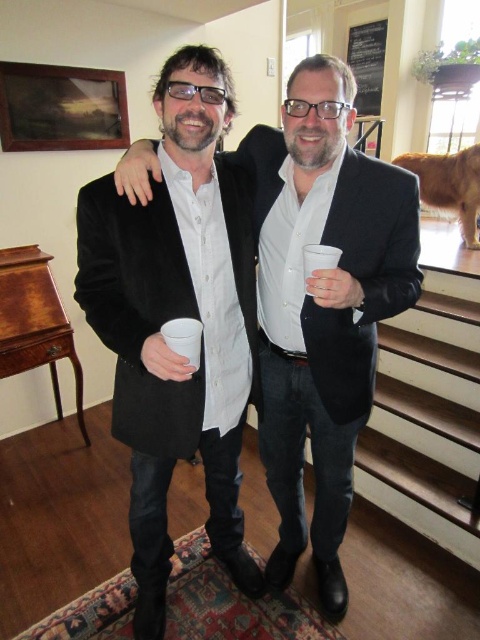
Based on the photo, you are at a party and need to choose between the two cups available. The white paper cup at center and the white styrofoam cup at center. Which one has a wider opening to easily add ice cubes?

The white paper cup at center has a wider opening than the white styrofoam cup at center, so it is better for adding ice cubes.

You are a tailor who needs to adjust the distance between the matte black coat at center and the matte black suit at center to 12 inches. What should you do?

The current distance between the matte black coat at center and the matte black suit at center is 9.80 inches. To increase it to 12 inches, move one of the items further away from the other by 2.2 inches.

You are standing in front of the two men at the event. You need to determine which of the two points, point (172, 330) or point (323, 257), is closer to you. Which one is closer?

Point (172, 330) is closer to you because it is further to the viewer than point (323, 257).